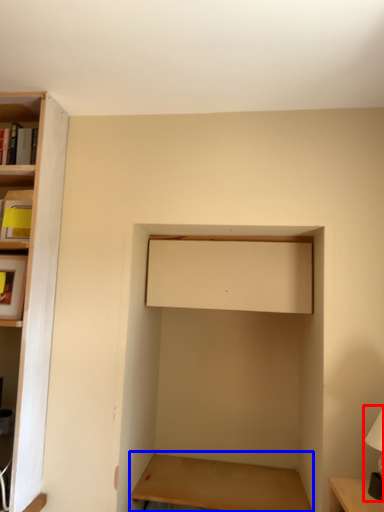
Question: Which object is closer to the camera taking this photo, table lamp (highlighted by a red box) or table (highlighted by a blue box)?

Choices:
 (A) table lamp
 (B) table

Answer: (A)